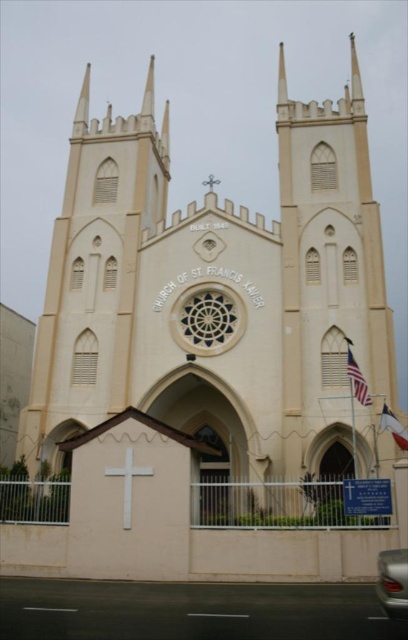
Question: Is white glossy car at lower right positioned in front of white wooden cross at center?

Choices:
 (A) no
 (B) yes

Answer: (B)

Question: Is white glossy car at lower right to the right of white wooden cross at center from the viewer's perspective?

Choices:
 (A) yes
 (B) no

Answer: (A)

Question: Considering the relative positions of white matte cross at center and blue fabric flag at center in the image provided, where is white matte cross at center located with respect to blue fabric flag at center?

Choices:
 (A) above
 (B) below

Answer: (B)

Question: Considering the real-world distances, which object is closest to the american flag at right?

Choices:
 (A) white matte cross at center
 (B) white glossy car at lower right
 (C) white wooden cross at center

Answer: (B)

Question: Based on their relative distances, which object is nearer to the white wooden cross at center?

Choices:
 (A) american flag at right
 (B) blue fabric flag at center

Answer: (B)

Question: Considering the real-world distances, which object is farthest from the american flag at right?

Choices:
 (A) white wooden cross at center
 (B) white matte cross at center
 (C) white glossy car at lower right
 (D) blue fabric flag at center

Answer: (A)